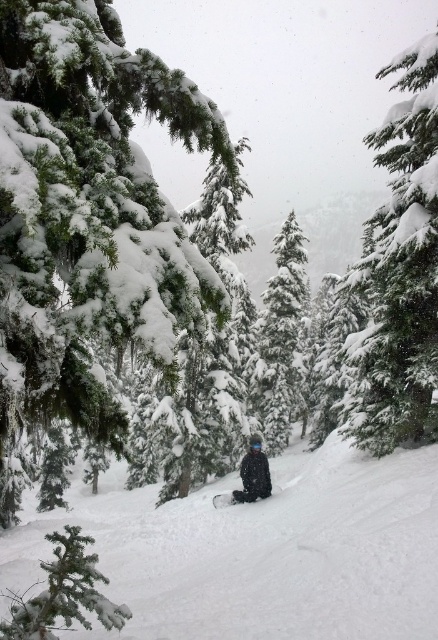
Question: Which point is farther from the camera taking this photo?

Choices:
 (A) (71, 573)
 (B) (279, 492)
 (C) (268, 412)

Answer: (C)

Question: Can you confirm if snow-covered evergreen tree at center is positioned to the left of black matte snowboard at center?

Choices:
 (A) yes
 (B) no

Answer: (B)

Question: Which object appears closest to the camera in this image?

Choices:
 (A) black matte snowboard at center
 (B) snow-covered evergreen tree at center
 (C) matte black snowboarder at center
 (D) snow-covered pine tree at lower left

Answer: (D)

Question: From the image, what is the correct spatial relationship of snow-covered evergreen tree at center in relation to snow-covered pine tree at lower left?

Choices:
 (A) left
 (B) right

Answer: (B)

Question: Estimate the real-world distances between objects in this image. Which object is closer to the green textured pine tree at center?

Choices:
 (A) white snowboard at center
 (B) black matte snowboard at center
 (C) snow-covered evergreen tree at center

Answer: (A)

Question: Is green textured pine tree at center closer to camera compared to snow-covered evergreen tree at center?

Choices:
 (A) yes
 (B) no

Answer: (A)